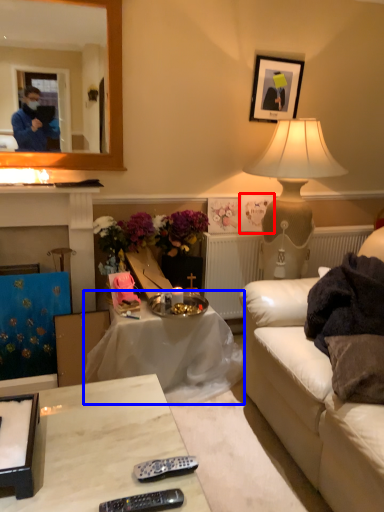
Question: Which object appears closest to the camera in this image, picture frame (highlighted by a red box) or table (highlighted by a blue box)?

Choices:
 (A) picture frame
 (B) table

Answer: (B)